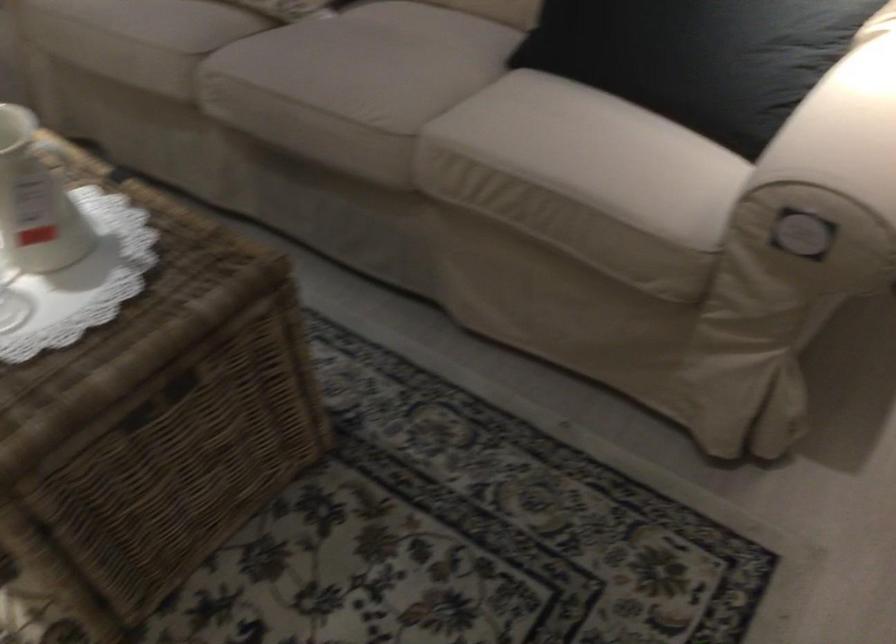
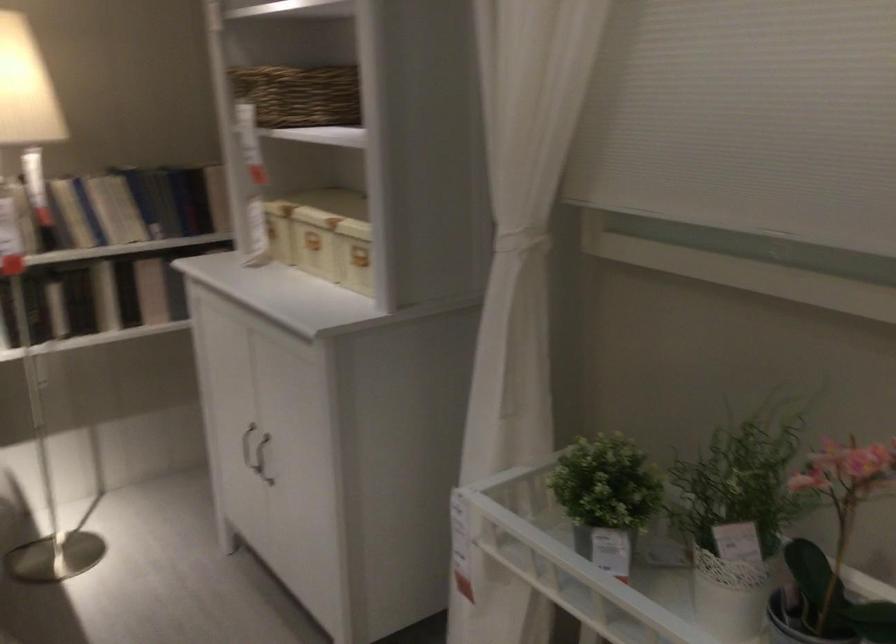
Question: The camera is either moving clockwise (left) or counter-clockwise (right) around the object. The first image is from the beginning of the video and the second image is from the end. Is the camera moving left or right when shooting the video?

Choices:
 (A) Left
 (B) Right

Answer: (A)